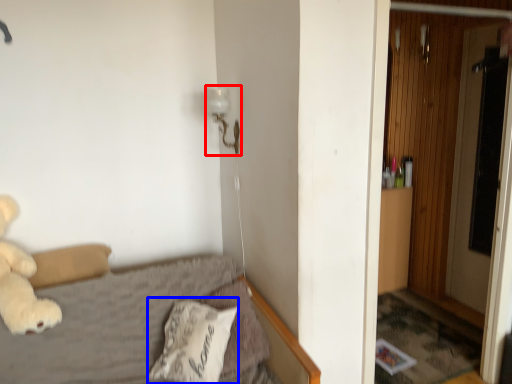
Question: Among these objects, which one is nearest to the camera, lamp (highlighted by a red box) or pillow (highlighted by a blue box)?

Choices:
 (A) lamp
 (B) pillow

Answer: (B)